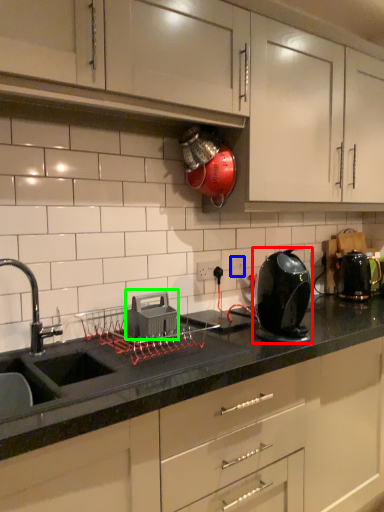
Question: Based on their relative distances, which object is nearer to home appliance (highlighted by a red box)? Choose from electric outlet (highlighted by a blue box) and appliance (highlighted by a green box).

Choices:
 (A) electric outlet
 (B) appliance

Answer: (B)